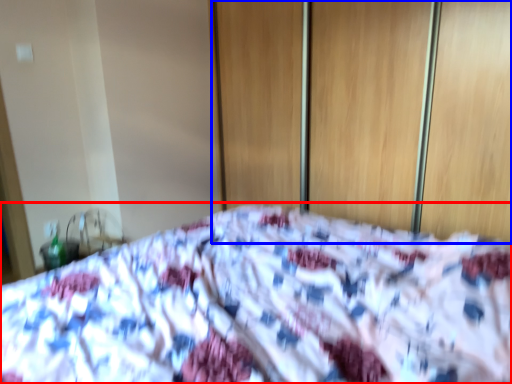
Question: Which object appears farthest to the camera in this image, bed (highlighted by a red box) or screen door (highlighted by a blue box)?

Choices:
 (A) bed
 (B) screen door

Answer: (B)